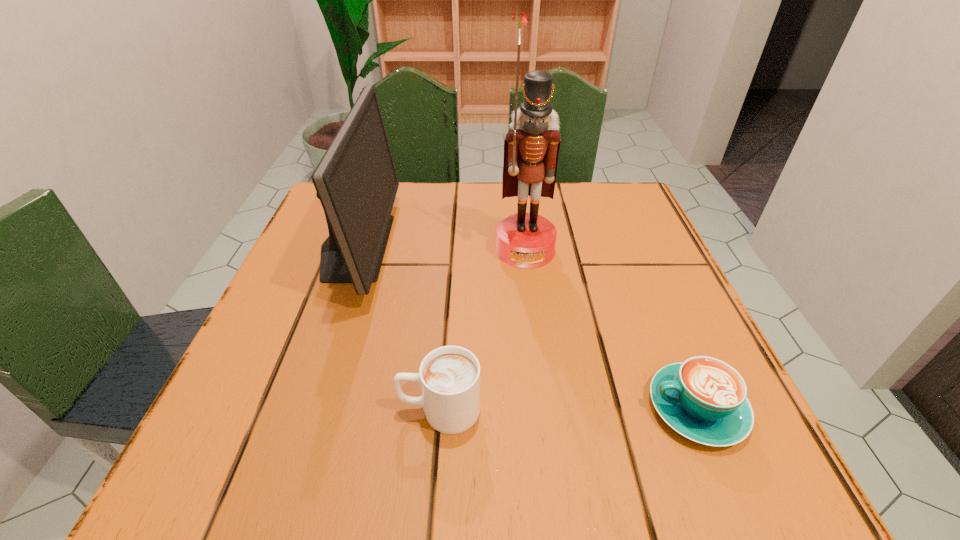
At what (x,y) coordinates should I click in order to perform the action: click on nutcracker. Please return your answer as a coordinate pair (x, y). This screenshot has width=960, height=540. Looking at the image, I should click on (526, 240).

Where is `the tallest object`? Image resolution: width=960 pixels, height=540 pixels. the tallest object is located at coordinates 526,240.

The width and height of the screenshot is (960, 540). What are the coordinates of `the second tallest object` in the screenshot? It's located at (356, 181).

Identify the location of computer monitor. The width and height of the screenshot is (960, 540). (356, 181).

Where is `the left cappuccino`? the left cappuccino is located at coordinates (449, 376).

The width and height of the screenshot is (960, 540). In order to click on the taller cappuccino in this screenshot , I will do `click(449, 376)`.

Find the location of a particular element. This screenshot has height=540, width=960. the rightmost object is located at coordinates (704, 399).

Identify the location of the shorter cappuccino. (x=704, y=399).

The width and height of the screenshot is (960, 540). What are the coordinates of `free space located on the front-facing side of the nutcracker` in the screenshot? It's located at (535, 327).

Locate an element on the screen. This screenshot has height=540, width=960. free space located on the screen side of the leftmost object is located at coordinates (581, 247).